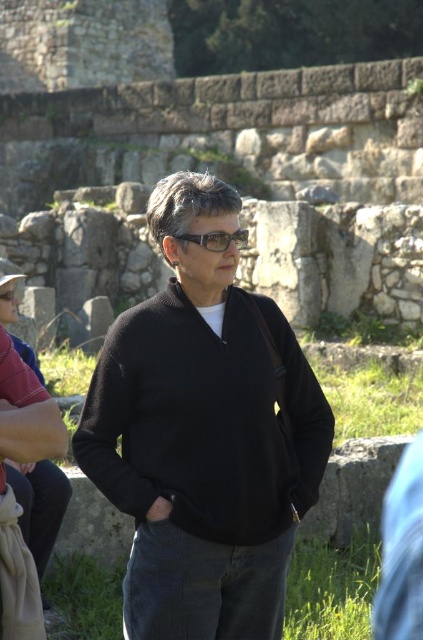
Who is positioned more to the left, black knitted sweater at center or transparent plastic glasses at center?

From the viewer's perspective, black knitted sweater at center appears more on the left side.

Does point (247, 614) lie in front of point (238, 236)?

That is True.

Locate an element on the screen. This screenshot has height=640, width=423. black knitted sweater at center is located at coordinates (203, 435).

Where is `black knitted sweater at center`? This screenshot has height=640, width=423. black knitted sweater at center is located at coordinates (203, 435).